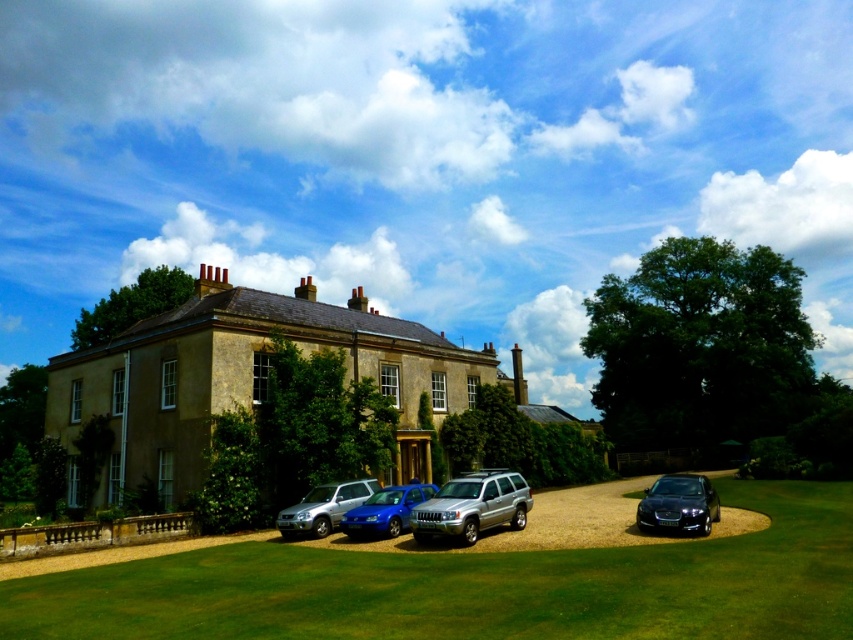
Question: Is silver metallic suvs at center below satin silver suv at lower left?

Choices:
 (A) no
 (B) yes

Answer: (B)

Question: Which object is farther from the camera taking this photo?

Choices:
 (A) silver metallic suv at center
 (B) silver metallic suvs at center
 (C) metallic blue sedan at center
 (D) satin silver suv at lower left

Answer: (D)

Question: Among these points, which one is nearest to the camera?

Choices:
 (A) (508, 486)
 (B) (805, 552)
 (C) (566, 516)

Answer: (B)

Question: Is silver metallic suv at center to the right of metallic blue sedan at center from the viewer's perspective?

Choices:
 (A) yes
 (B) no

Answer: (A)

Question: Estimate the real-world distances between objects in this image. Which object is farther from the green grass lawn at lower center?

Choices:
 (A) silver metallic suvs at center
 (B) silver metallic suv at center
 (C) glossy black car at lower right
 (D) satin silver suv at lower left

Answer: (D)

Question: Can you confirm if green grass lawn at lower center is bigger than silver metallic suvs at center?

Choices:
 (A) no
 (B) yes

Answer: (A)